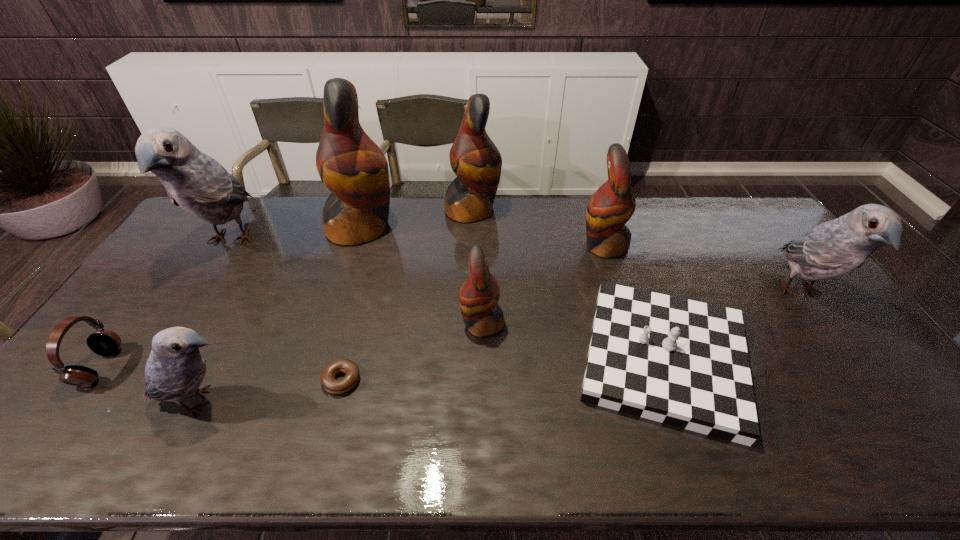
Identify the location of vacant space situated on the face of the third biggest red parrot. (550, 245).

The width and height of the screenshot is (960, 540). I want to click on vacant space located on the face of the third biggest red parrot, so click(513, 245).

Identify the location of vacant space located 0.250m on the face of the third biggest red parrot. (507, 245).

Locate an element on the screen. The image size is (960, 540). vacant region located on the front-facing side of the rightmost object is located at coordinates pos(852,366).

Where is `free space located 0.370m on the front-facing side of the nearest parrot`? free space located 0.370m on the front-facing side of the nearest parrot is located at coordinates (398, 402).

This screenshot has width=960, height=540. I want to click on vacant region located on the face of the smallest red parrot, so click(348, 323).

Find the location of a particular element. free space located on the face of the smallest red parrot is located at coordinates (425, 323).

Identify the location of vacant space located 0.060m on the face of the smallest red parrot. The height and width of the screenshot is (540, 960). (440, 323).

The image size is (960, 540). I want to click on free space located 0.060m on the ear pads of the black headset, so pyautogui.click(x=137, y=367).

At what (x,y) coordinates should I click in order to perform the action: click on vacant region located 0.270m on the back of the checkerboard. Please return your answer as a coordinate pair (x, y). Looking at the image, I should click on (619, 238).